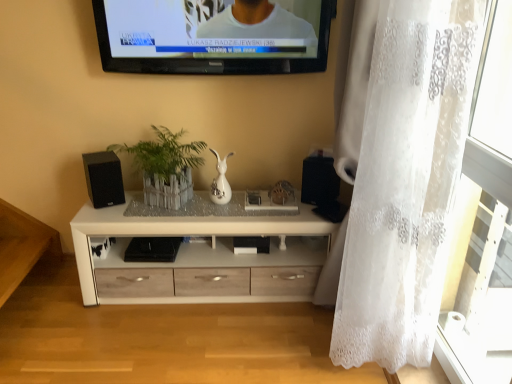
This screenshot has width=512, height=384. In order to click on transparent glass door at right in this screenshot , I will do `click(484, 278)`.

Locate an element on the screen. This screenshot has height=384, width=512. green leafy plant at center is located at coordinates (165, 167).

You are a GUI agent. You are given a task and a screenshot of the screen. Output one action in this format:
    pyautogui.click(x=<x>, y=<y>)
    Task: Click on the black matte speaker at right, placed as the second speaker when sorted from left to right
    This screenshot has height=384, width=512.
    Given the screenshot: What is the action you would take?
    pyautogui.click(x=319, y=180)

Between black matte speaker at right, acting as the 1th speaker starting from the right, and green leafy plant at center, which one appears on the right side from the viewer's perspective?

black matte speaker at right, acting as the 1th speaker starting from the right.

Are black matte speaker at right, acting as the 1th speaker starting from the right, and green leafy plant at center located far from each other?

No, black matte speaker at right, acting as the 1th speaker starting from the right, is not far away from green leafy plant at center.

This screenshot has height=384, width=512. I want to click on houseplant that is in front of the black matte speaker at right, acting as the 1th speaker starting from the right, so click(x=165, y=167).

Does black matte speaker at right, placed as the second speaker when sorted from left to right, have a greater width compared to green leafy plant at center?

Yes, black matte speaker at right, placed as the second speaker when sorted from left to right, is wider than green leafy plant at center.

Is transparent glass door at right surrounding green leafy plant at center?

Actually, green leafy plant at center is outside transparent glass door at right.

Between transparent glass door at right and green leafy plant at center, which one has larger size?

green leafy plant at center.

Does transparent glass door at right have a greater height compared to green leafy plant at center?

Indeed, transparent glass door at right has a greater height compared to green leafy plant at center.

Who is smaller, white lace curtain at right or transparent glass door at right?

Smaller between the two is transparent glass door at right.

Based on the photo, from the image's perspective, is white lace curtain at right over transparent glass door at right?

Yes, from the image's perspective, white lace curtain at right is above transparent glass door at right.

Between white lace curtain at right and transparent glass door at right, which one appears on the left side from the viewer's perspective?

white lace curtain at right.

What's the angular difference between black matte speaker at left, which is the 2th speaker in right-to-left order, and white wood chest of drawers at center's facing directions?

The angle between the facing direction of black matte speaker at left, which is the 2th speaker in right-to-left order, and the facing direction of white wood chest of drawers at center is 29.7 degrees.

Looking at this image, which is correct: black matte speaker at left, the first speaker positioned from the left, is inside white wood chest of drawers at center, or outside of it?

The correct answer is: outside.

Could you tell me if black matte speaker at left, which is the 2th speaker in right-to-left order, is turned towards white wood chest of drawers at center?

No, black matte speaker at left, which is the 2th speaker in right-to-left order, does not turn towards white wood chest of drawers at center.

Does black matte speaker at left, the first speaker positioned from the left, have a larger size compared to white wood chest of drawers at center?

Actually, black matte speaker at left, the first speaker positioned from the left, might be smaller than white wood chest of drawers at center.

Which object is wider, transparent glass door at right or white lace curtain at right?

white lace curtain at right is wider.

Is point (463, 271) more distant than point (381, 171)?

Yes.

Is transparent glass door at right oriented away from white lace curtain at right?

No, transparent glass door at right is not facing away from white lace curtain at right.

From the image's perspective, is green leafy plant at center located above or below white wood chest of drawers at center?

green leafy plant at center is situated higher than white wood chest of drawers at center in the image.

Looking at this image, considering the sizes of green leafy plant at center and white wood chest of drawers at center in the image, is green leafy plant at center bigger or smaller than white wood chest of drawers at center?

Considering their sizes, green leafy plant at center takes up less space than white wood chest of drawers at center.

Does green leafy plant at center have a lesser height compared to white wood chest of drawers at center?

Yes, green leafy plant at center is shorter than white wood chest of drawers at center.

From a real-world perspective, who is located higher, green leafy plant at center or white wood chest of drawers at center?

green leafy plant at center, from a real-world perspective.

Could you tell me if green leafy plant at center is facing white lace curtain at right?

No.

From the picture: Is green leafy plant at center to the left of white lace curtain at right from the viewer's perspective?

Yes, green leafy plant at center is to the left of white lace curtain at right.

Which point is more distant from viewer, (184, 170) or (431, 141)?

The point (184, 170) is more distant.

In the scene shown: Considering the sizes of green leafy plant at center and white lace curtain at right in the image, is green leafy plant at center taller or shorter than white lace curtain at right?

Clearly, green leafy plant at center is shorter compared to white lace curtain at right.

Where is `houseplant that is on the left side of black matte speaker at right, acting as the 1th speaker starting from the right`? houseplant that is on the left side of black matte speaker at right, acting as the 1th speaker starting from the right is located at coordinates (165, 167).

You are a GUI agent. You are given a task and a screenshot of the screen. Output one action in this format:
    pyautogui.click(x=<x>, y=<y>)
    Task: Click on the glass door below the green leafy plant at center (from the image's perspective)
    This screenshot has height=384, width=512.
    Given the screenshot: What is the action you would take?
    pyautogui.click(x=484, y=278)

Considering their positions, is green leafy plant at center positioned further to white wood chest of drawers at center than transparent glass door at right?

Among the two, transparent glass door at right is located further to white wood chest of drawers at center.

Considering their positions, is black matte speaker at left, which is the 2th speaker in right-to-left order, positioned closer to green leafy plant at center than white wood chest of drawers at center?

black matte speaker at left, which is the 2th speaker in right-to-left order, is positioned closer to the anchor green leafy plant at center.

Looking at the image, which one is located closer to black matte speaker at left, which is the 2th speaker in right-to-left order, black glossy television at upper center or white wood chest of drawers at center?

white wood chest of drawers at center is closer to black matte speaker at left, which is the 2th speaker in right-to-left order.

In the scene shown: Which object lies nearer to the anchor point transparent glass door at right, green leafy plant at center or white lace curtain at right?

white lace curtain at right lies closer to transparent glass door at right than the other object.

Based on their spatial positions, is black glossy television at upper center or black matte speaker at right, placed as the second speaker when sorted from left to right, closer to black matte speaker at left, the first speaker positioned from the left?

black glossy television at upper center lies closer to black matte speaker at left, the first speaker positioned from the left, than the other object.

Estimate the real-world distances between objects in this image. Which object is closer to black matte speaker at right, placed as the second speaker when sorted from left to right, green leafy plant at center or transparent glass door at right?

Among the two, green leafy plant at center is located nearer to black matte speaker at right, placed as the second speaker when sorted from left to right.

Looking at the image, which one is located further to black matte speaker at right, placed as the second speaker when sorted from left to right, white wood chest of drawers at center or white lace curtain at right?

white lace curtain at right is positioned further to the anchor black matte speaker at right, placed as the second speaker when sorted from left to right.

In the scene shown: From the image, which object appears to be nearer to green leafy plant at center, white lace curtain at right or white wood chest of drawers at center?

white wood chest of drawers at center is closer to green leafy plant at center.

The height and width of the screenshot is (384, 512). In order to click on chest of drawers between green leafy plant at center and black matte speaker at right, acting as the 1th speaker starting from the right, from left to right in this screenshot , I will do `click(179, 231)`.

Locate an element on the screen. The height and width of the screenshot is (384, 512). speaker between black matte speaker at left, the first speaker positioned from the left, and white lace curtain at right, in the horizontal direction is located at coordinates point(319,180).

Locate an element on the screen. This screenshot has width=512, height=384. television between green leafy plant at center and white lace curtain at right in the horizontal direction is located at coordinates (214, 36).

This screenshot has width=512, height=384. Find the location of `speaker between green leafy plant at center and transparent glass door at right from left to right`. speaker between green leafy plant at center and transparent glass door at right from left to right is located at coordinates (319, 180).